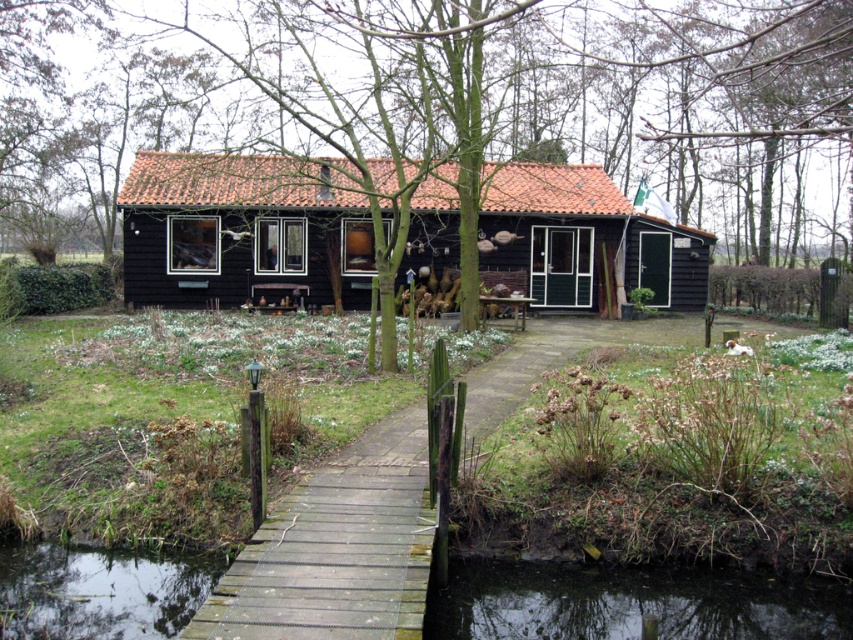
You are a visitor approaching the black wood cottage at center via the wooden bridge. As you walk over the transparent water at bridge bottom, how does the height of the cottage compare to the water below?

The black wood cottage at center is taller than the transparent water at bridge bottom.

You are standing at the center of the wooden bridge and want to walk to the black wooden house. Which direction should you move relative to the black water at lower left?

Since the black water at lower left is located at point (631, 604), you should move towards the upper right direction to reach the black wooden house from the wooden bridge.

You are standing at the wooden bridge leading to the black wooden house. You see two points marked in the scene. The first point is at coordinates point (802, 186) and the second point is at point (132, 557). Which point is closer to you?

Point (132, 557) is closer to you because it is less further to the camera than point (802, 186).